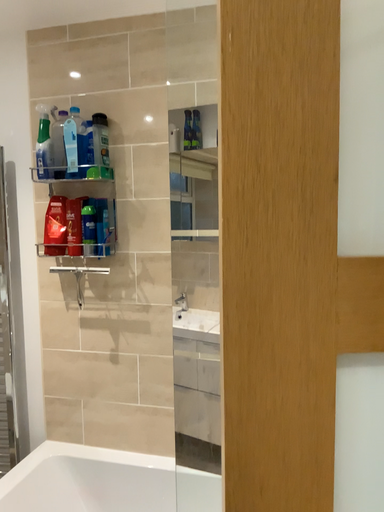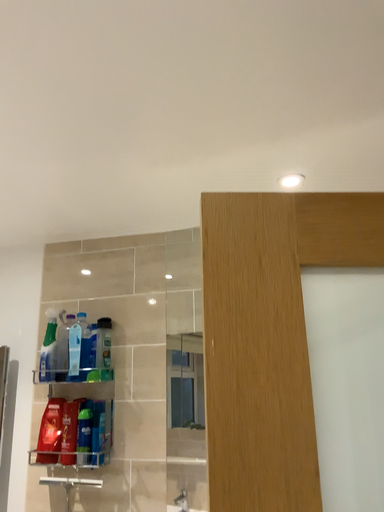
Question: Which way did the camera rotate in the video?

Choices:
 (A) rotated downward
 (B) rotated upward

Answer: (B)